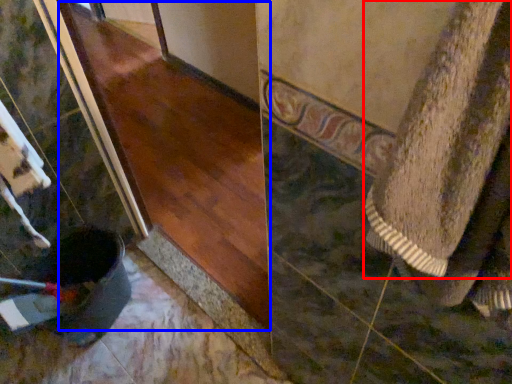
Question: Which point is closer to the camera, towel (highlighted by a red box) or wood (highlighted by a blue box)?

Choices:
 (A) towel
 (B) wood

Answer: (A)